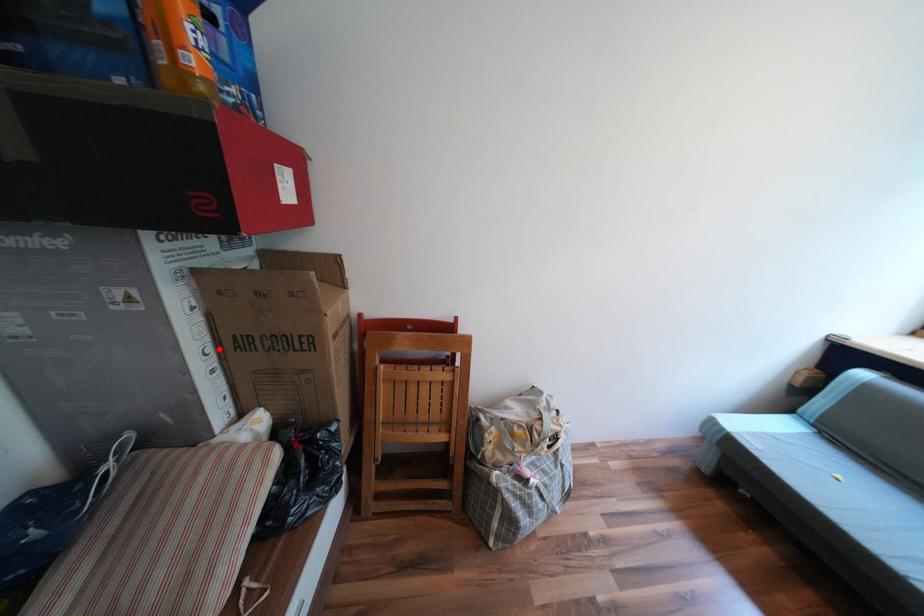
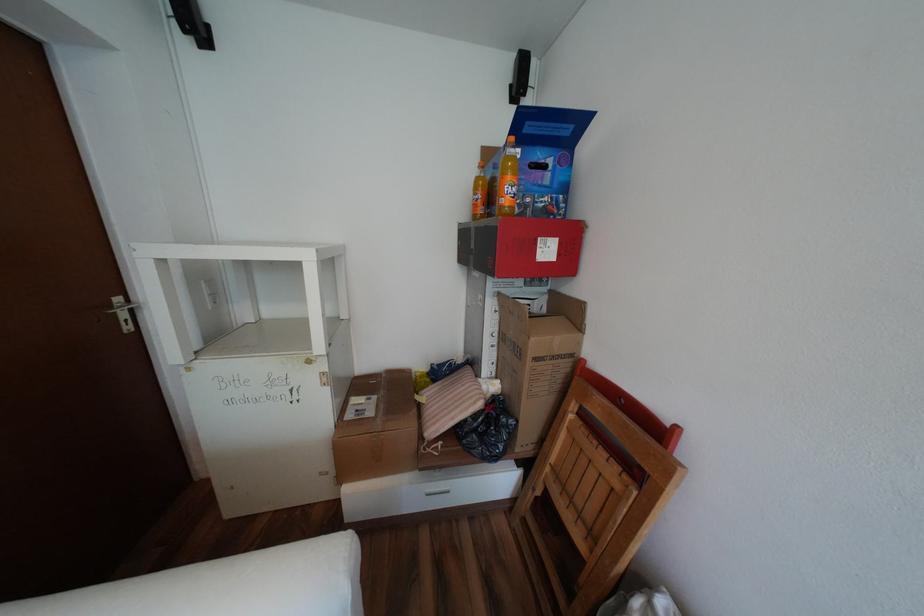
Where in the second image is the point corresponding to the highlighted location from the first image?

(505, 334)